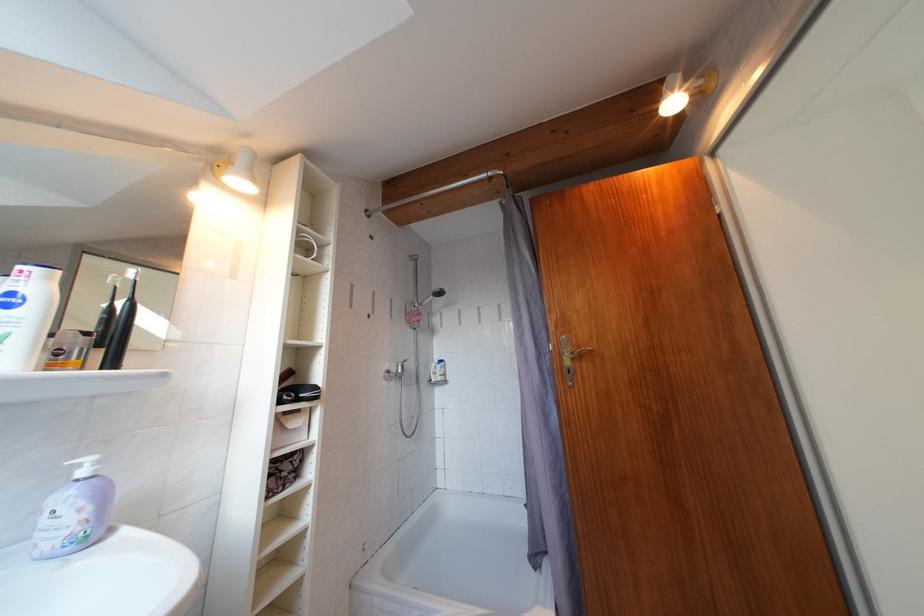
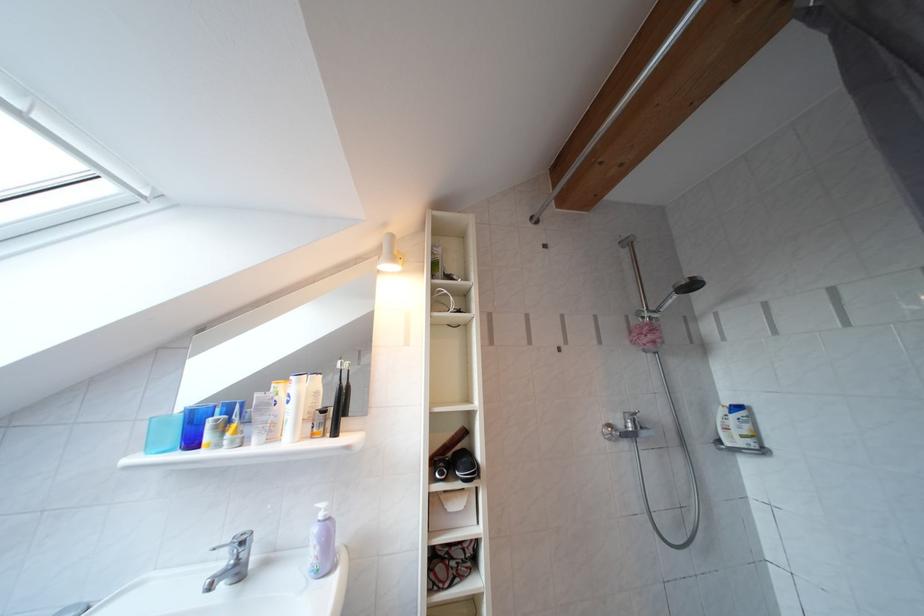
Question: The camera is either moving clockwise (left) or counter-clockwise (right) around the object. The first image is from the beginning of the video and the second image is from the end. Is the camera moving left or right when shooting the video?

Choices:
 (A) Left
 (B) Right

Answer: (B)